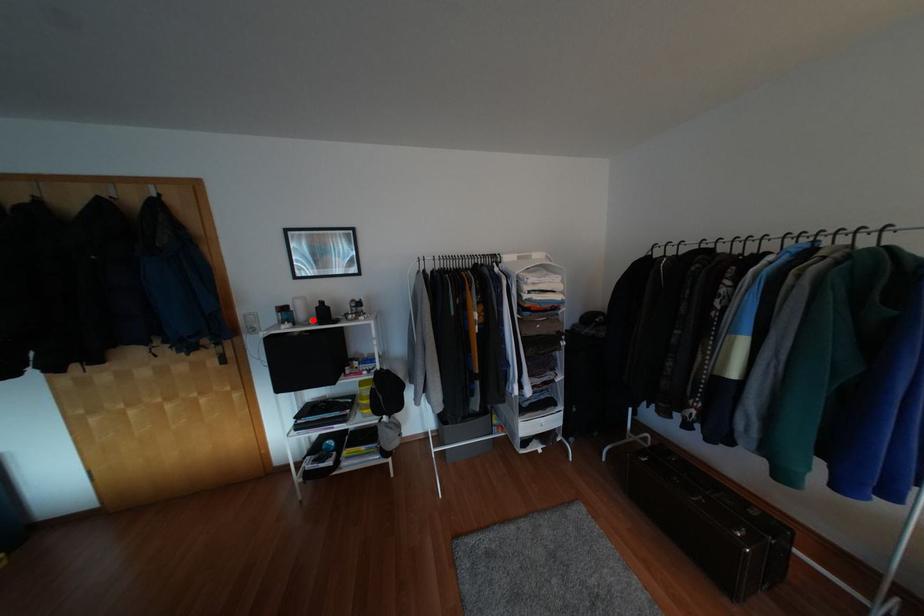
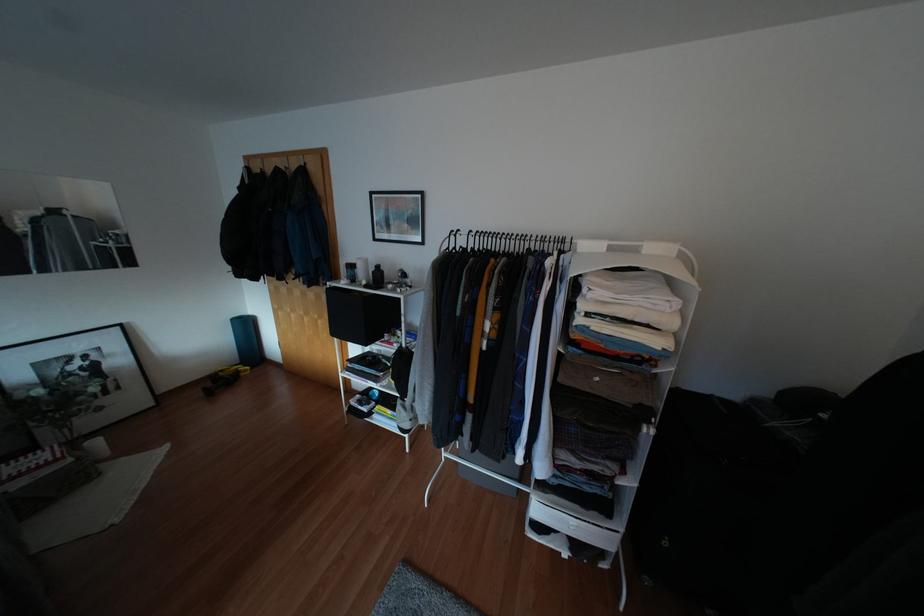
Find the pixel in the second image that matches the highlighted location in the first image.

(362, 282)